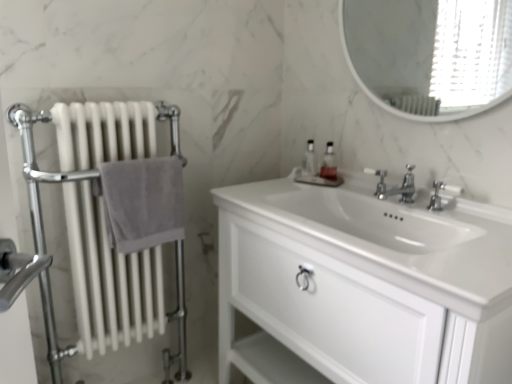
Where is `free space on the front side of polished chrome faucet at center`? The width and height of the screenshot is (512, 384). free space on the front side of polished chrome faucet at center is located at coordinates tap(395, 205).